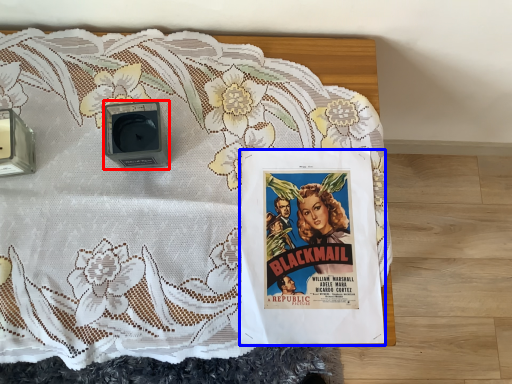
Question: Which object is closer to the camera taking this photo, alarm (highlighted by a red box) or poster (highlighted by a blue box)?

Choices:
 (A) alarm
 (B) poster

Answer: (A)